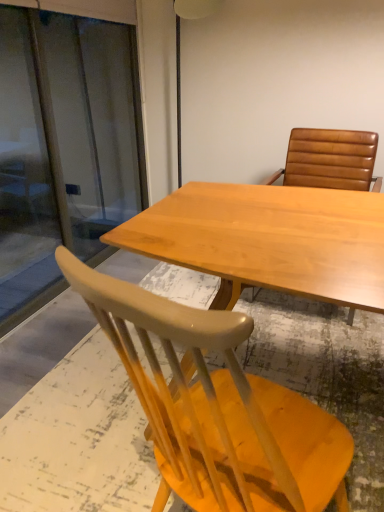
Question: Does transparent glass screen door at left come behind light wood table at center?

Choices:
 (A) no
 (B) yes

Answer: (B)

Question: From the image's perspective, would you say transparent glass screen door at left is positioned over light wood table at center?

Choices:
 (A) yes
 (B) no

Answer: (A)

Question: Considering the relative sizes of transparent glass screen door at left and light wood table at center in the image provided, is transparent glass screen door at left thinner than light wood table at center?

Choices:
 (A) no
 (B) yes

Answer: (B)

Question: Is transparent glass screen door at left not near light wood table at center?

Choices:
 (A) yes
 (B) no

Answer: (A)

Question: Considering the relative sizes of transparent glass screen door at left and light wood table at center in the image provided, is transparent glass screen door at left shorter than light wood table at center?

Choices:
 (A) yes
 (B) no

Answer: (B)

Question: Can you confirm if transparent glass screen door at left is taller than light wood table at center?

Choices:
 (A) yes
 (B) no

Answer: (A)

Question: Considering the relative positions of brown leather chair at upper right, acting as the 1th chair starting from the top, and light wood table at center in the image provided, is brown leather chair at upper right, acting as the 1th chair starting from the top, to the right of light wood table at center from the viewer's perspective?

Choices:
 (A) yes
 (B) no

Answer: (A)

Question: Is brown leather chair at upper right, the second chair from the bottom, facing away from light wood table at center?

Choices:
 (A) yes
 (B) no

Answer: (B)

Question: Can you confirm if brown leather chair at upper right, the second chair from the bottom, is bigger than light wood table at center?

Choices:
 (A) no
 (B) yes

Answer: (A)

Question: Considering the relative sizes of brown leather chair at upper right, acting as the 1th chair starting from the top, and light wood table at center in the image provided, is brown leather chair at upper right, acting as the 1th chair starting from the top, shorter than light wood table at center?

Choices:
 (A) no
 (B) yes

Answer: (A)

Question: Would you consider brown leather chair at upper right, acting as the 1th chair starting from the top, to be distant from light wood table at center?

Choices:
 (A) yes
 (B) no

Answer: (B)

Question: Is brown leather chair at upper right, acting as the 1th chair starting from the top, taller than light wood table at center?

Choices:
 (A) no
 (B) yes

Answer: (B)

Question: Is brown leather chair at upper right, the second chair from the bottom, shorter than transparent glass screen door at left?

Choices:
 (A) no
 (B) yes

Answer: (B)